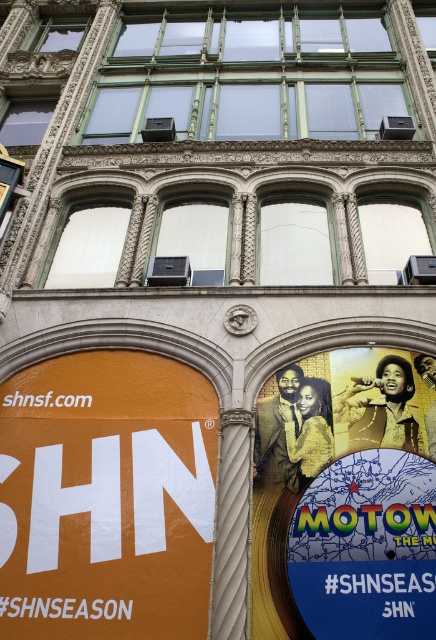
Does orange matte sign at lower left have a smaller size compared to matte vinyl record at center?

No.

Consider the image. Can you confirm if orange matte sign at lower left is taller than matte vinyl record at center?

No.

Find the location of a particular element. Image resolution: width=436 pixels, height=640 pixels. orange matte sign at lower left is located at coordinates (106, 499).